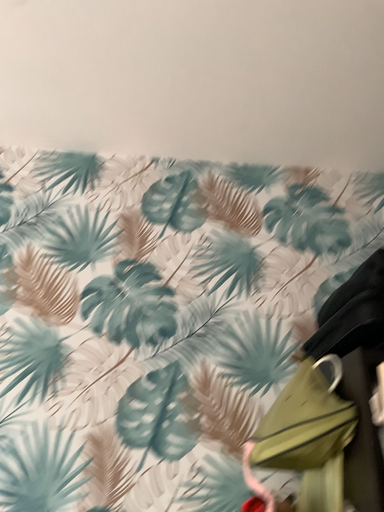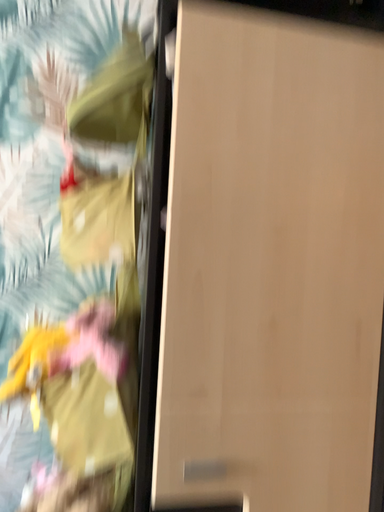
Question: Which way did the camera rotate in the video?

Choices:
 (A) rotated upward
 (B) rotated downward

Answer: (B)